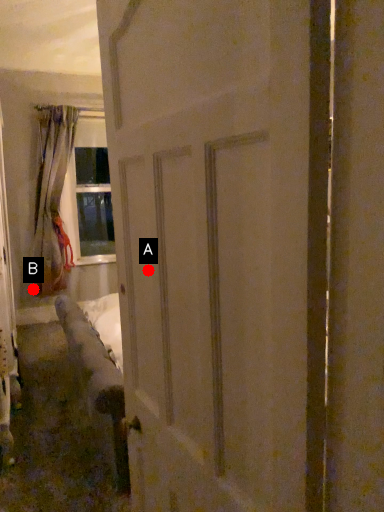
Question: Two points are circled on the image, labeled by A and B beside each circle. Which point appears farthest from the camera in this image?

Choices:
 (A) A is further
 (B) B is further

Answer: (B)